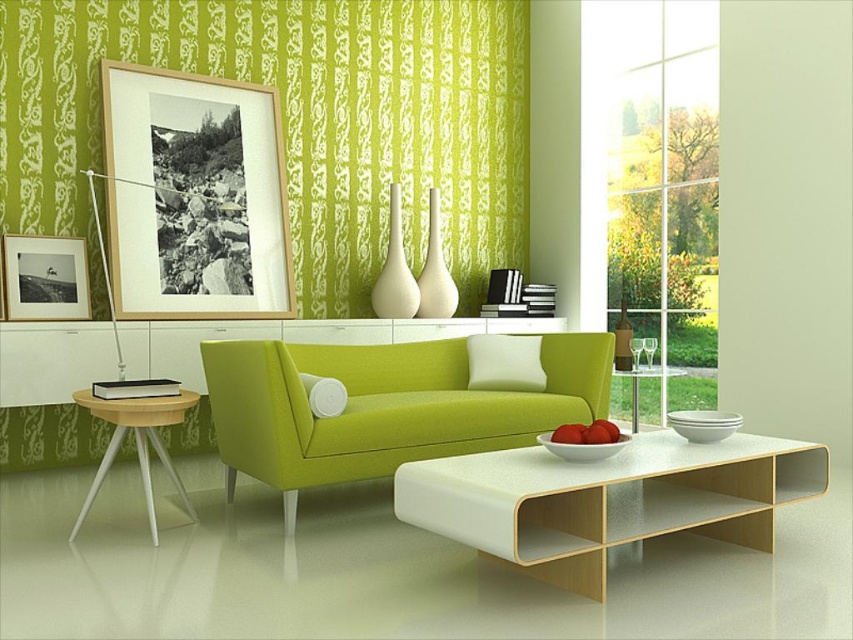
Who is more forward, (373, 134) or (631, 412)?

Positioned in front is point (373, 134).

Where is `green fabric curtain at upper center`? This screenshot has height=640, width=853. green fabric curtain at upper center is located at coordinates (296, 122).

Does point (334, 1) come behind point (662, 374)?

Yes, point (334, 1) is behind point (662, 374).

Where is `green fabric curtain at upper center`? This screenshot has height=640, width=853. green fabric curtain at upper center is located at coordinates (296, 122).

Can you confirm if green fabric curtain at upper center is positioned to the left of matte black picture frame at left?

Incorrect, green fabric curtain at upper center is not on the left side of matte black picture frame at left.

Which of these two, green fabric curtain at upper center or matte black picture frame at left, stands taller?

Standing taller between the two is green fabric curtain at upper center.

This screenshot has width=853, height=640. What do you see at coordinates (296, 122) in the screenshot?
I see `green fabric curtain at upper center` at bounding box center [296, 122].

This screenshot has height=640, width=853. What are the coordinates of `green fabric curtain at upper center` in the screenshot? It's located at point(296,122).

Who is lower down, white glossy table at center or light brown wood side table at left?

white glossy table at center is below.

Is white glossy table at center above light brown wood side table at left?

Actually, white glossy table at center is below light brown wood side table at left.

The height and width of the screenshot is (640, 853). What do you see at coordinates (607, 499) in the screenshot? I see `white glossy table at center` at bounding box center [607, 499].

The height and width of the screenshot is (640, 853). What are the coordinates of `white glossy table at center` in the screenshot? It's located at (607, 499).